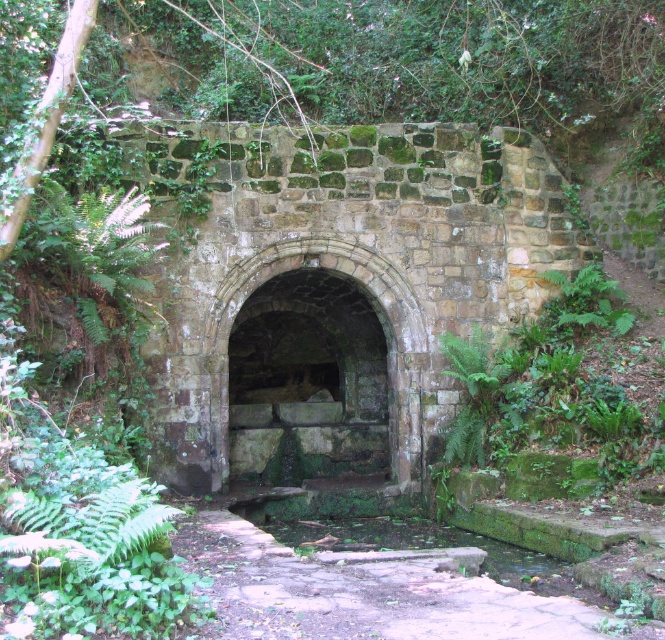
Question: Can you confirm if green mossy stone arch at center is smaller than mossy stone path at center?

Choices:
 (A) no
 (B) yes

Answer: (B)

Question: Does green mossy stone arch at center have a larger size compared to mossy stone path at center?

Choices:
 (A) yes
 (B) no

Answer: (B)

Question: Which point is closer to the camera?

Choices:
 (A) mossy stone path at center
 (B) green mossy stone arch at center

Answer: (A)

Question: Is green mossy stone arch at center positioned in front of mossy stone path at center?

Choices:
 (A) no
 (B) yes

Answer: (A)

Question: Which of the following is the closest to the observer?

Choices:
 (A) (309, 624)
 (B) (422, 342)

Answer: (A)

Question: Which of the following is the closest to the observer?

Choices:
 (A) green mossy stone arch at center
 (B) mossy stone path at center

Answer: (B)